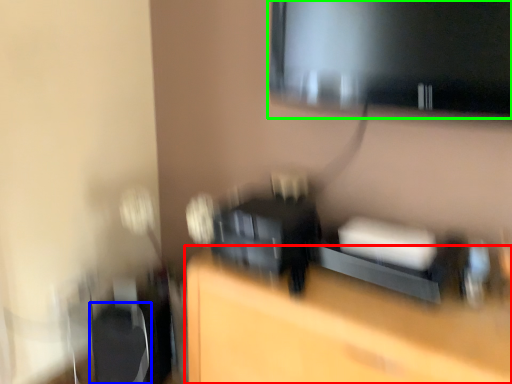
Question: Which object is the closest to the furniture (highlighted by a red box)? Choose among these: swivel chair (highlighted by a blue box) or computer monitor (highlighted by a green box).

Choices:
 (A) swivel chair
 (B) computer monitor

Answer: (A)